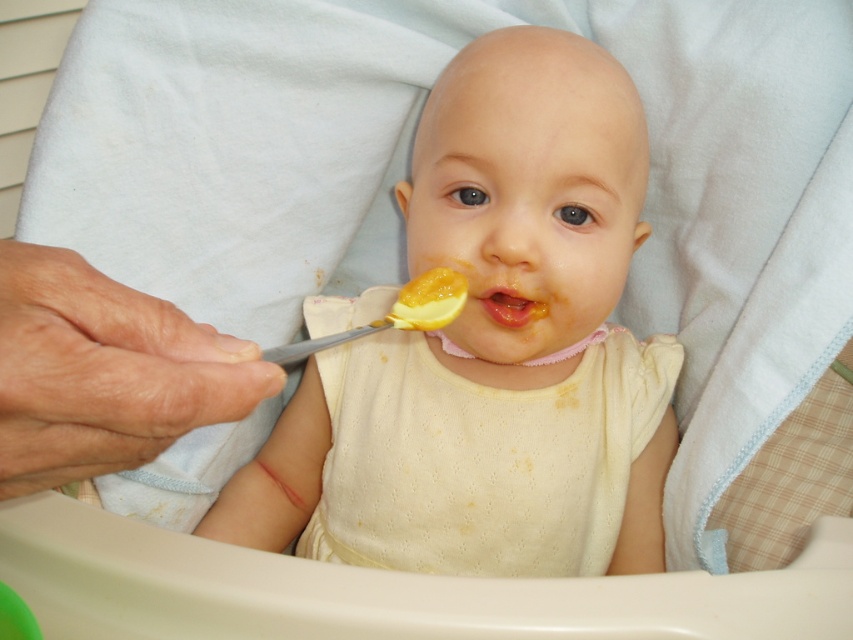
Question: Can you confirm if white dotted fabric bib at center is positioned below yellow matte food at center?

Choices:
 (A) no
 (B) yes

Answer: (B)

Question: Is white dotted fabric bib at center positioned at the back of yellow matte food at center?

Choices:
 (A) yes
 (B) no

Answer: (A)

Question: Which object is the closest to the yellow matte food at center?

Choices:
 (A) yellow matte spoon at center
 (B) white dotted fabric bib at center

Answer: (A)

Question: Which point is closer to the camera?

Choices:
 (A) (509, 316)
 (B) (399, 524)
 (C) (339, 301)

Answer: (A)

Question: In this image, where is yellow matte spoon at center located relative to yellow matte food at center?

Choices:
 (A) below
 (B) above

Answer: (A)

Question: Which object appears farthest from the camera in this image?

Choices:
 (A) yellow matte spoon at center
 (B) white dotted fabric bib at center
 (C) yellow matte food at center

Answer: (B)